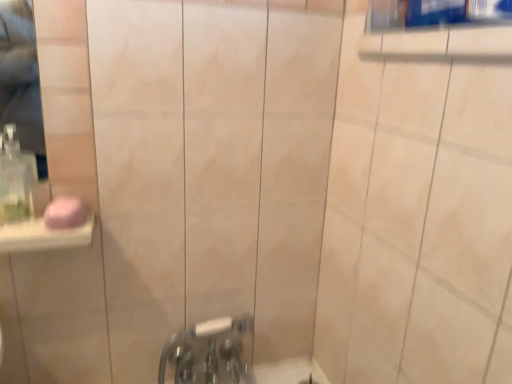
Question: From a real-world perspective, is chrome metallic faucet at lower center positioned above or below clear plastic soap dispenser at left?

Choices:
 (A) below
 (B) above

Answer: (A)

Question: Considering their positions, is chrome metallic faucet at lower center located in front of or behind clear plastic soap dispenser at left?

Choices:
 (A) behind
 (B) front

Answer: (A)

Question: Which of these objects is positioned farthest from the chrome metallic faucet at lower center?

Choices:
 (A) pink matte soap at left
 (B) clear plastic soap dispenser at left

Answer: (B)

Question: Considering the real-world distances, which object is closest to the pink matte soap at left?

Choices:
 (A) chrome metallic faucet at lower center
 (B) clear plastic soap dispenser at left

Answer: (B)